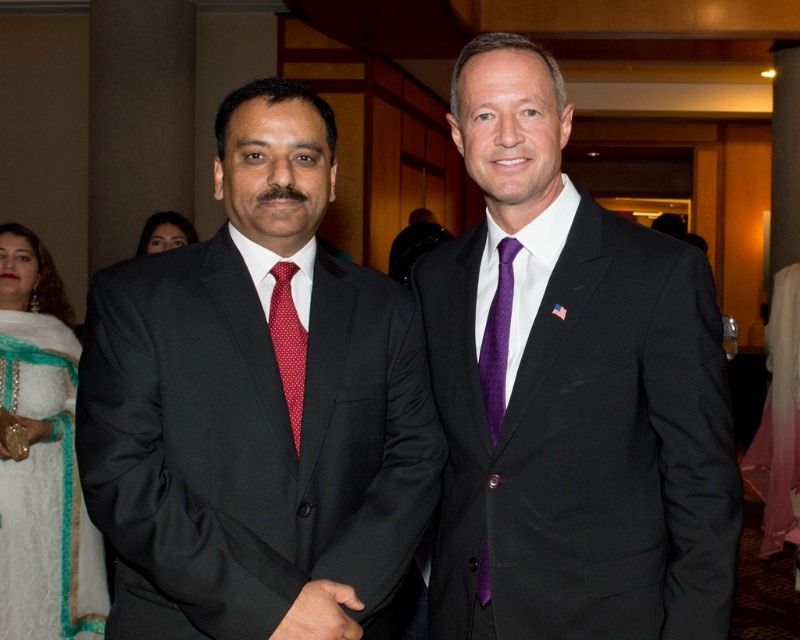
Question: Which point is closer to the camera taking this photo?

Choices:
 (A) (442, 266)
 (B) (333, 516)
 (C) (40, 476)
 (D) (277, 324)

Answer: (B)

Question: Which object appears farthest from the camera in this image?

Choices:
 (A) purple satin suit at center
 (B) matte black suit at center
 (C) red dotted fabric tie at left
 (D) purple textured tie at center

Answer: (D)

Question: Is matte black suit at center to the right of purple satin suit at center from the viewer's perspective?

Choices:
 (A) yes
 (B) no

Answer: (B)

Question: Considering the real-world distances, which object is farthest from the white lace dress at lower left?

Choices:
 (A) matte black suit at center
 (B) red dotted fabric tie at left
 (C) purple satin suit at center

Answer: (C)

Question: Does white lace dress at lower left appear over red dotted fabric tie at left?

Choices:
 (A) no
 (B) yes

Answer: (A)

Question: Considering the relative positions of matte black suit at center and purple textured tie at center in the image provided, where is matte black suit at center located with respect to purple textured tie at center?

Choices:
 (A) left
 (B) right

Answer: (A)